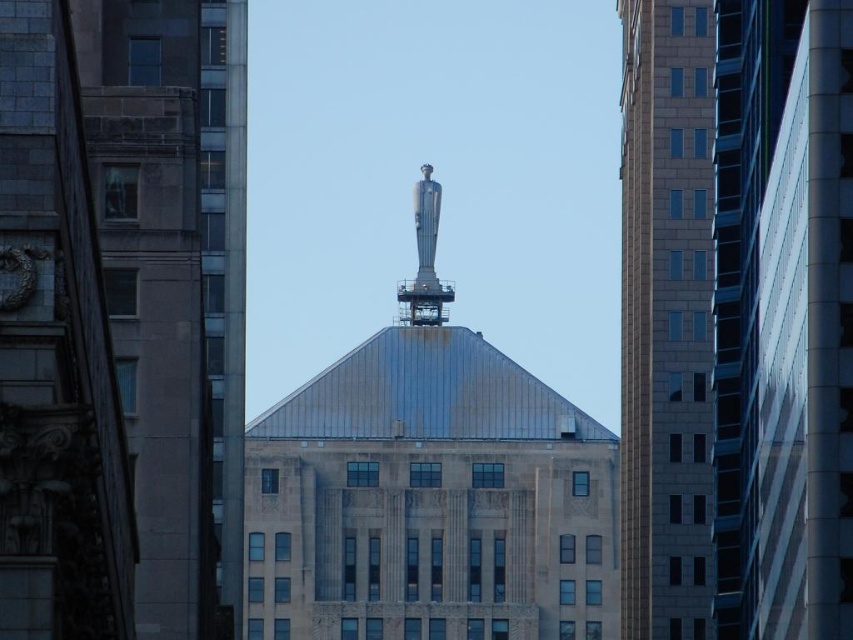
Does smooth glass skyscraper at center have a lesser width compared to silver metallic spire at center?

Indeed, smooth glass skyscraper at center has a lesser width compared to silver metallic spire at center.

Who is higher up, smooth glass skyscraper at center or silver metallic spire at center?

silver metallic spire at center is higher up.

Who is more distant from viewer, (744, 396) or (430, 225)?

The point (430, 225) is more distant.

Find the location of a particular element. This screenshot has width=853, height=640. smooth glass skyscraper at center is located at coordinates (782, 320).

Is silver metallic statue at center to the left of slate gray concrete building at right from the viewer's perspective?

Correct, you'll find silver metallic statue at center to the left of slate gray concrete building at right.

Consider the image. Can you confirm if silver metallic statue at center is wider than slate gray concrete building at right?

Yes.

Does point (436, 490) come farther from viewer compared to point (703, 426)?

Yes, it is behind point (703, 426).

Locate an element on the screen. The width and height of the screenshot is (853, 640). silver metallic statue at center is located at coordinates (428, 490).

How distant is silver metallic statue at center from gray stone tower at left?

89.09 meters

Is point (541, 580) positioned before point (225, 486)?

No, it is behind (225, 486).

Describe the element at coordinates (428, 490) in the screenshot. This screenshot has height=640, width=853. I see `silver metallic statue at center` at that location.

Locate an element on the screen. silver metallic statue at center is located at coordinates (428, 490).